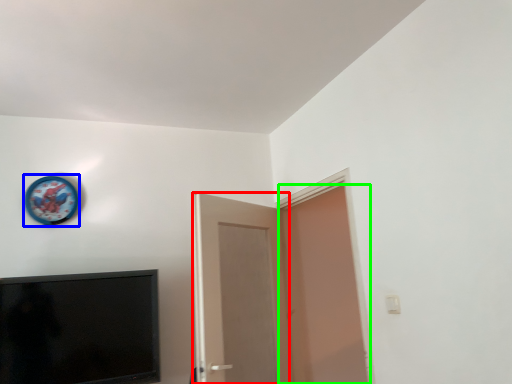
Question: Considering the real-world distances, which object is farthest from door (highlighted by a red box)? clock (highlighted by a blue box) or door (highlighted by a green box)?

Choices:
 (A) clock
 (B) door

Answer: (A)